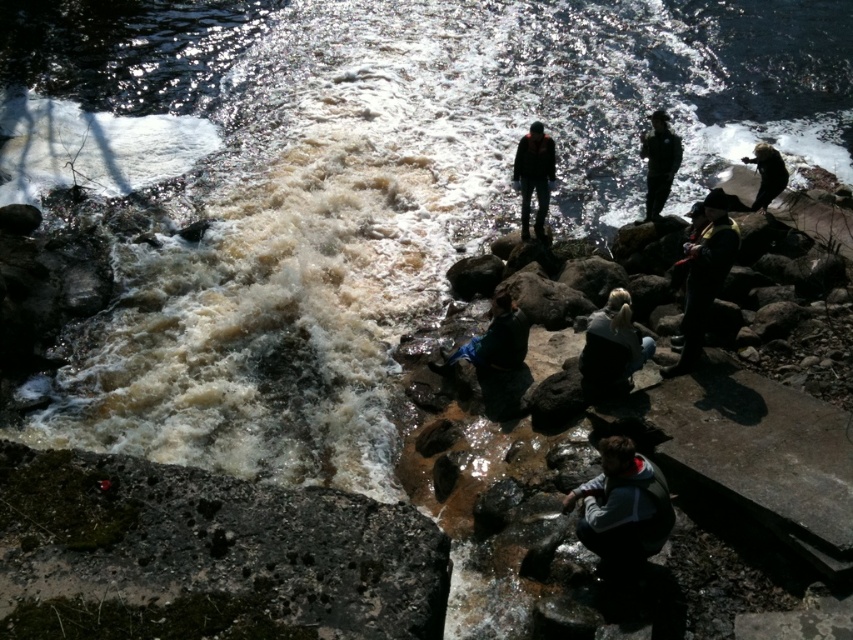
You are a photographer trying to capture a photo of the dark blue jeans at center while also including the green mossy rock at lower left in the frame. Based on their positions, can you position yourself in a way that both objects are visible in the same shot?

The green mossy rock at lower left is positioned on the left side of dark blue jeans at center, so yes, you can position yourself to the left of the dark blue jeans at center to include both objects in the frame.

You are a photographer standing at the edge of the water feature. You want to capture a photo of the blue denim jeans at center. However, there is a safety guideline stating that you must stay at least 10 meters away from the edge to avoid slipping into the water. Can you safely take the photo from your current position?

The blue denim jeans at center are 9.31 meters away from you. Since the safety guideline requires staying at least 10 meters away, you are too close to safely take the photo from your current position.